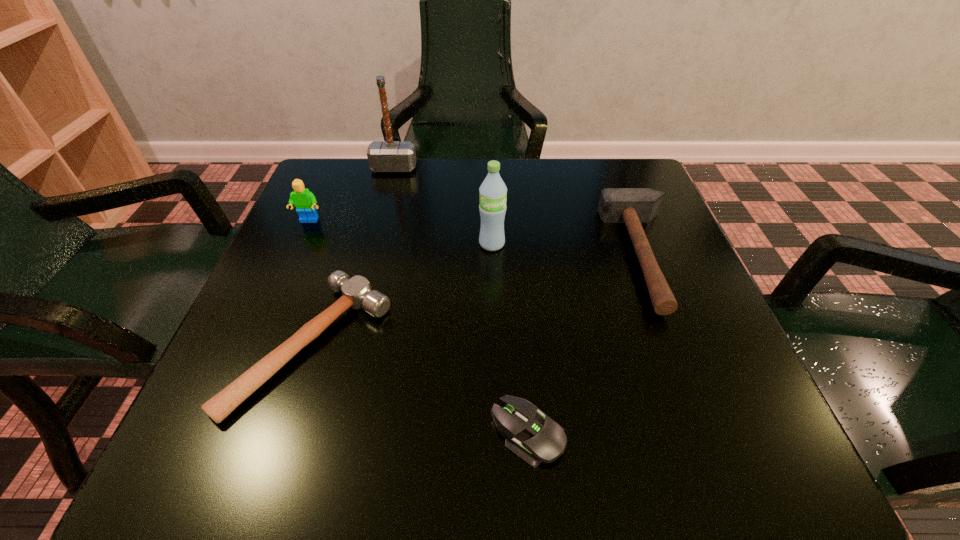
Image resolution: width=960 pixels, height=540 pixels. I want to click on vacant space located on the face of the third tallest object, so point(245,365).

Find the location of `blank space located 0.160m on the striking surface of the rightmost object`. blank space located 0.160m on the striking surface of the rightmost object is located at coordinates (532, 256).

This screenshot has height=540, width=960. Identify the location of vacant region located on the striking surface of the rightmost object. (562, 256).

Identify the location of free region located on the striking surface of the rightmost object. The height and width of the screenshot is (540, 960). (422, 256).

Where is `vacant space located 0.160m on the back of the fifth tallest object`? The image size is (960, 540). vacant space located 0.160m on the back of the fifth tallest object is located at coordinates (350, 229).

Identify the location of vacant space located 0.330m on the back of the computer mouse. Image resolution: width=960 pixels, height=540 pixels. (514, 253).

Locate an element on the screen. The height and width of the screenshot is (540, 960). hammer that is positioned at the near edge is located at coordinates (357, 293).

Where is `computer mouse that is at the near edge`? This screenshot has width=960, height=540. computer mouse that is at the near edge is located at coordinates (536, 438).

At what (x,y) coordinates should I click in order to perform the action: click on Lego located at the left edge. Please return your answer as a coordinate pair (x, y). Image resolution: width=960 pixels, height=540 pixels. Looking at the image, I should click on (304, 200).

The image size is (960, 540). I want to click on object located in the right edge section of the desktop, so click(x=632, y=206).